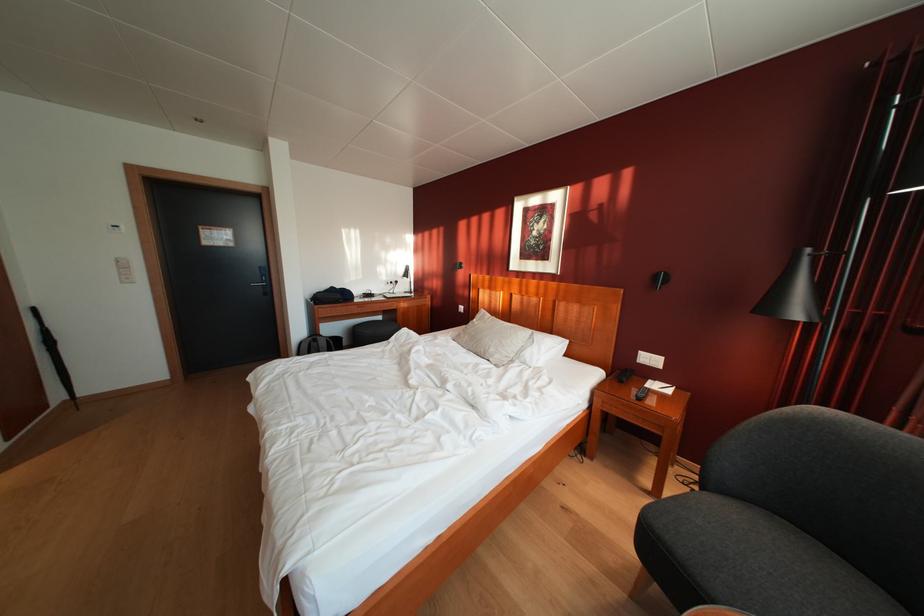
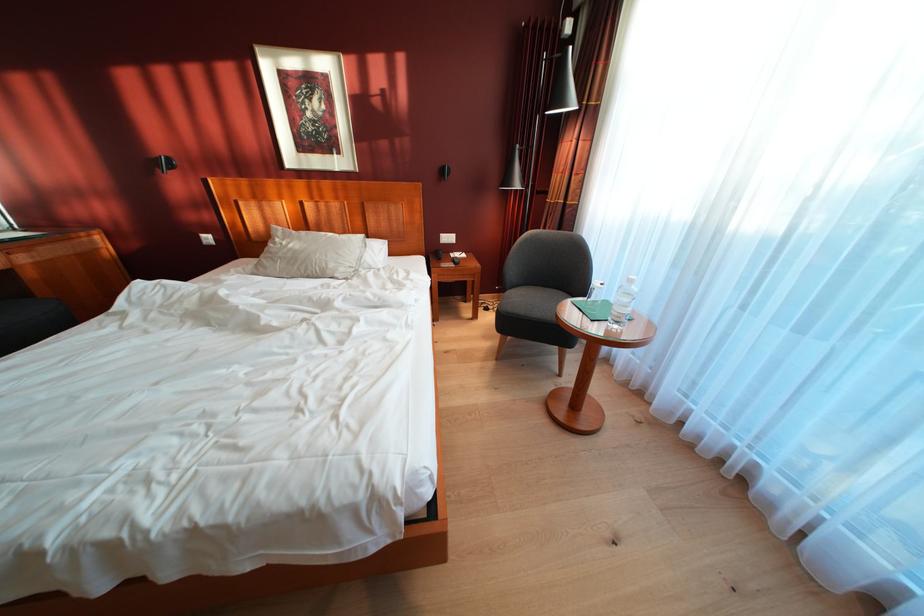
In the second image, find the point that corresponds to (495,361) in the first image.

(336, 278)